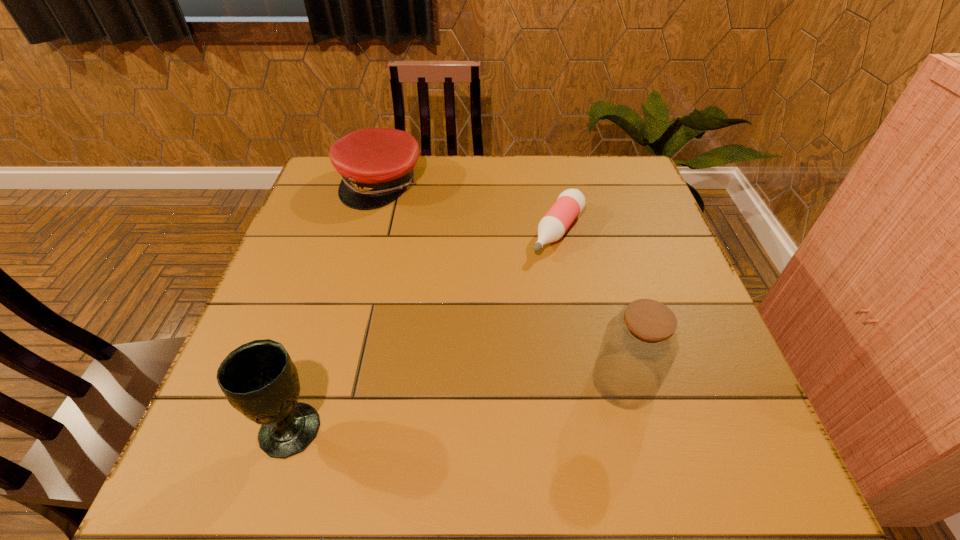
In order to click on vacant space that's between the shortest object and the jar in this screenshot , I will do `click(591, 306)`.

Find the location of a particular element. Image resolution: width=960 pixels, height=540 pixels. blank region between the chalice and the jar is located at coordinates (457, 404).

Find the location of a particular element. The image size is (960, 540). free spot between the chalice and the jar is located at coordinates (457, 404).

Identify the location of free space that is in between the chalice and the third tallest object. This screenshot has height=540, width=960. (335, 305).

Identify the location of vacant space that's between the chalice and the shortest object. The image size is (960, 540). pos(424,329).

This screenshot has height=540, width=960. Find the location of `object that stands as the third closest to the jar`. object that stands as the third closest to the jar is located at coordinates (376, 164).

Identify the location of object that is the second closest one to the second shortest object. The height and width of the screenshot is (540, 960). (259, 379).

This screenshot has height=540, width=960. I want to click on free location that satisfies the following two spatial constraints: 1. on the back side of the chalice; 2. on the right side of the shortest object, so click(351, 231).

I want to click on free spot that satisfies the following two spatial constraints: 1. on the back side of the chalice; 2. on the right side of the shortest object, so click(x=351, y=231).

Find the location of a particular element. Image resolution: width=960 pixels, height=540 pixels. vacant region that satisfies the following two spatial constraints: 1. on the front side of the jar; 2. on the left side of the cap is located at coordinates (327, 381).